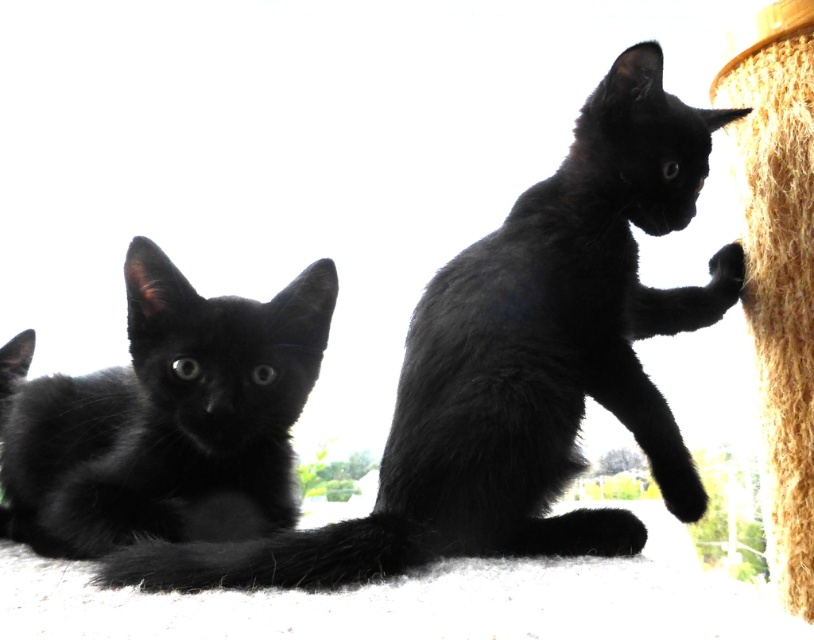
Who is more forward, (182, 369) or (755, 177)?

Point (182, 369) is more forward.

Which of these two, matte black kitten at left or coarse straw rope at right, stands shorter?

With less height is matte black kitten at left.

Is point (18, 476) farther from camera compared to point (766, 177)?

No, it is in front of (766, 177).

Find the location of a particular element. The height and width of the screenshot is (640, 814). matte black kitten at left is located at coordinates (165, 419).

Is black fur cat at center above coarse straw rope at right?

No.

Looking at this image, is black fur cat at center positioned in front of coarse straw rope at right?

That is True.

Find the location of a particular element. The width and height of the screenshot is (814, 640). black fur cat at center is located at coordinates (519, 368).

At what (x,y) coordinates should I click in order to perform the action: click on black fur cat at center. Please return your answer as a coordinate pair (x, y). The width and height of the screenshot is (814, 640). Looking at the image, I should click on (519, 368).

Does black fur cat at center appear under matte black kitten at left?

Incorrect, black fur cat at center is not positioned below matte black kitten at left.

Is the position of black fur cat at center more distant than that of matte black kitten at left?

No, black fur cat at center is in front of matte black kitten at left.

Describe the element at coordinates (519, 368) in the screenshot. I see `black fur cat at center` at that location.

The width and height of the screenshot is (814, 640). I want to click on black fur cat at center, so click(519, 368).